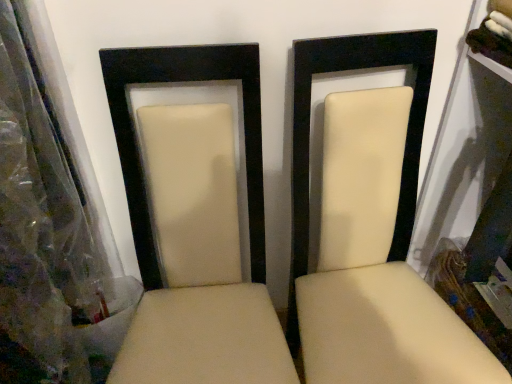
Question: From a real-world perspective, is beige leather chair at center, positioned as the second chair in left-to-right order, physically below beige leather chair at center, which is the second chair from right to left?

Choices:
 (A) yes
 (B) no

Answer: (B)

Question: Is beige leather chair at center, positioned as the second chair in left-to-right order, completely or partially outside of beige leather chair at center, marked as the 1th chair in a left-to-right arrangement?

Choices:
 (A) yes
 (B) no

Answer: (A)

Question: Is beige leather chair at center, which ranks as the 1th chair in right-to-left order, to the left of beige leather chair at center, which is the second chair from right to left, from the viewer's perspective?

Choices:
 (A) no
 (B) yes

Answer: (A)

Question: Is beige leather chair at center, which ranks as the 1th chair in right-to-left order, surrounding beige leather chair at center, which is the second chair from right to left?

Choices:
 (A) yes
 (B) no

Answer: (B)

Question: Is beige leather chair at center, positioned as the second chair in left-to-right order, bigger than beige leather chair at center, which is the second chair from right to left?

Choices:
 (A) no
 (B) yes

Answer: (B)

Question: Does beige leather chair at center, positioned as the second chair in left-to-right order, have a lesser width compared to beige leather chair at center, marked as the 1th chair in a left-to-right arrangement?

Choices:
 (A) no
 (B) yes

Answer: (B)

Question: Could beige leather chair at center, positioned as the second chair in left-to-right order, be considered to be inside beige leather chair at center, marked as the 1th chair in a left-to-right arrangement?

Choices:
 (A) yes
 (B) no

Answer: (B)

Question: From a real-world perspective, is beige leather chair at center, which is the second chair from right to left, on beige leather chair at center, positioned as the second chair in left-to-right order?

Choices:
 (A) yes
 (B) no

Answer: (B)

Question: Considering the relative sizes of beige leather chair at center, marked as the 1th chair in a left-to-right arrangement, and beige leather chair at center, which ranks as the 1th chair in right-to-left order, in the image provided, is beige leather chair at center, marked as the 1th chair in a left-to-right arrangement, thinner than beige leather chair at center, which ranks as the 1th chair in right-to-left order,?

Choices:
 (A) no
 (B) yes

Answer: (A)

Question: Is beige leather chair at center, marked as the 1th chair in a left-to-right arrangement, at the right side of beige leather chair at center, positioned as the second chair in left-to-right order?

Choices:
 (A) no
 (B) yes

Answer: (A)

Question: Does beige leather chair at center, marked as the 1th chair in a left-to-right arrangement, have a greater height compared to beige leather chair at center, positioned as the second chair in left-to-right order?

Choices:
 (A) no
 (B) yes

Answer: (A)

Question: Does beige leather chair at center, marked as the 1th chair in a left-to-right arrangement, have a larger size compared to beige leather chair at center, positioned as the second chair in left-to-right order?

Choices:
 (A) yes
 (B) no

Answer: (B)

Question: From a real-world perspective, is beige leather chair at center, which ranks as the 1th chair in right-to-left order, physically located above or below beige leather chair at center, which is the second chair from right to left?

Choices:
 (A) below
 (B) above

Answer: (B)